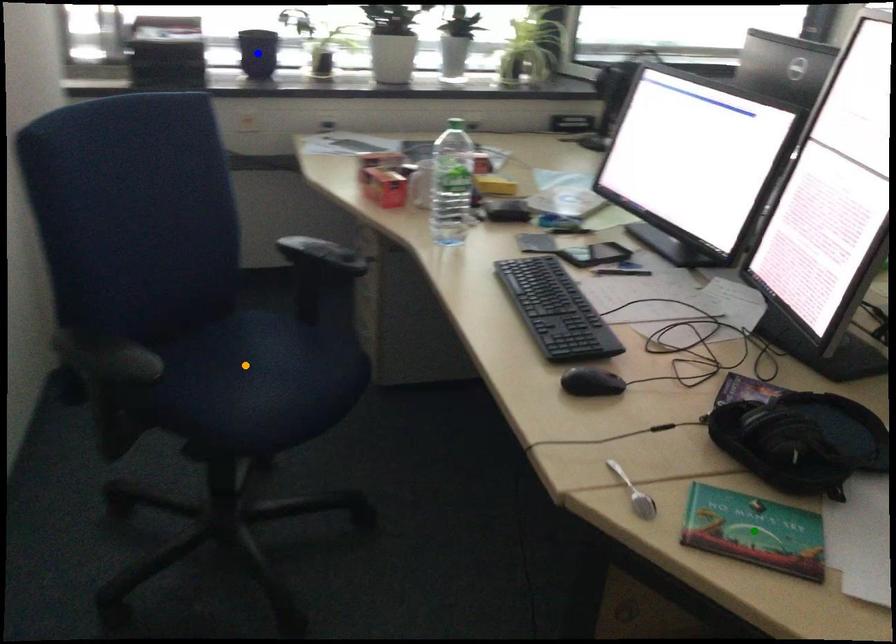
Order these from nearest to farthest:
blue point | orange point | green point

green point < orange point < blue point